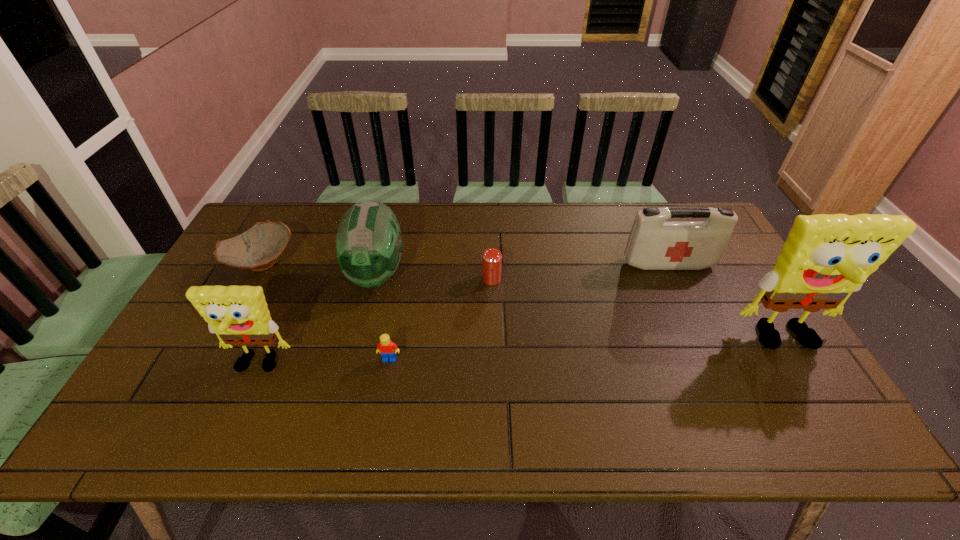
This screenshot has height=540, width=960. I want to click on object that is at the far left corner, so click(257, 249).

The width and height of the screenshot is (960, 540). Find the location of `object located in the near left corner section of the desktop`. object located in the near left corner section of the desktop is located at coordinates (239, 315).

Image resolution: width=960 pixels, height=540 pixels. Find the location of `vacant space at the far edge of the desktop`. vacant space at the far edge of the desktop is located at coordinates tap(575, 208).

Where is `free space at the right edge of the desktop`? This screenshot has height=540, width=960. free space at the right edge of the desktop is located at coordinates (748, 317).

Image resolution: width=960 pixels, height=540 pixels. Identify the location of vacant space at the far left corner of the desktop. (287, 218).

Find the location of a particular element. free space at the near left corner of the desktop is located at coordinates (197, 381).

Find the location of a particular element. vacant space at the far right corner is located at coordinates (677, 202).

Find the location of `free point between the Lego and the pottery`. free point between the Lego and the pottery is located at coordinates (325, 311).

Where is `vacant space in between the Lego and the football helmet`? vacant space in between the Lego and the football helmet is located at coordinates (383, 316).

The width and height of the screenshot is (960, 540). Identify the location of free area in between the pottery and the tallest object. (524, 302).